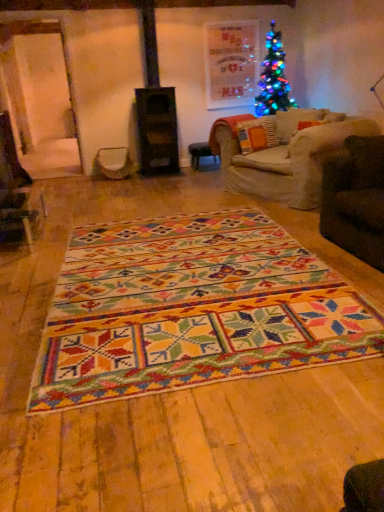
Question: From a real-world perspective, is metallic silver swivel chair at center physically located above or below multicolored woven rug at center?

Choices:
 (A) above
 (B) below

Answer: (A)

Question: From their relative heights in the image, would you say metallic silver swivel chair at center is taller or shorter than multicolored woven rug at center?

Choices:
 (A) tall
 (B) short

Answer: (A)

Question: Which object is the closest to the wooden stool at center?

Choices:
 (A) multicolored woven rug at center
 (B) textured orange pillow at center
 (C) metallic silver swivel chair at center

Answer: (C)

Question: Estimate the real-world distances between objects in this image. Which object is closer to the multicolored woven rug at center?

Choices:
 (A) textured orange pillow at center
 (B) metallic silver swivel chair at center
 (C) wooden stool at center

Answer: (A)